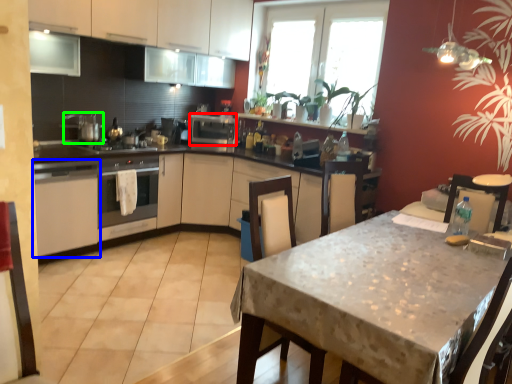
Question: Estimate the real-world distances between objects in this image. Which object is farther from appliance (highlighted by a red box), cabinetry (highlighted by a blue box) or appliance (highlighted by a green box)?

Choices:
 (A) cabinetry
 (B) appliance

Answer: (A)